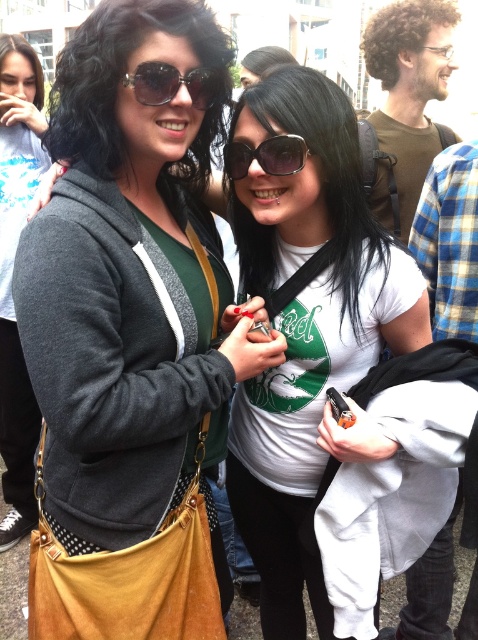
Question: Which point is closer to the camera taking this photo?

Choices:
 (A) (289, 163)
 (B) (79, 506)

Answer: (B)

Question: Does matte black sunglasses at upper left have a smaller size compared to matte black jacket at center?

Choices:
 (A) yes
 (B) no

Answer: (A)

Question: Considering the real-world distances, which object is farthest from the matte black hoodie at center?

Choices:
 (A) matte black jacket at center
 (B) white matte t-shirt at center
 (C) sunglasses at center
 (D) matte black sunglasses at upper center

Answer: (A)

Question: Is white matte t-shirt at center bigger than matte black sunglasses at upper center?

Choices:
 (A) yes
 (B) no

Answer: (A)

Question: Is matte black sunglasses at upper left closer to the viewer compared to sunglasses at center?

Choices:
 (A) no
 (B) yes

Answer: (B)

Question: Among these points, which one is farthest from the camera?

Choices:
 (A) (28, 120)
 (B) (161, 99)
 (C) (265, 243)
 (D) (293, 145)

Answer: (A)